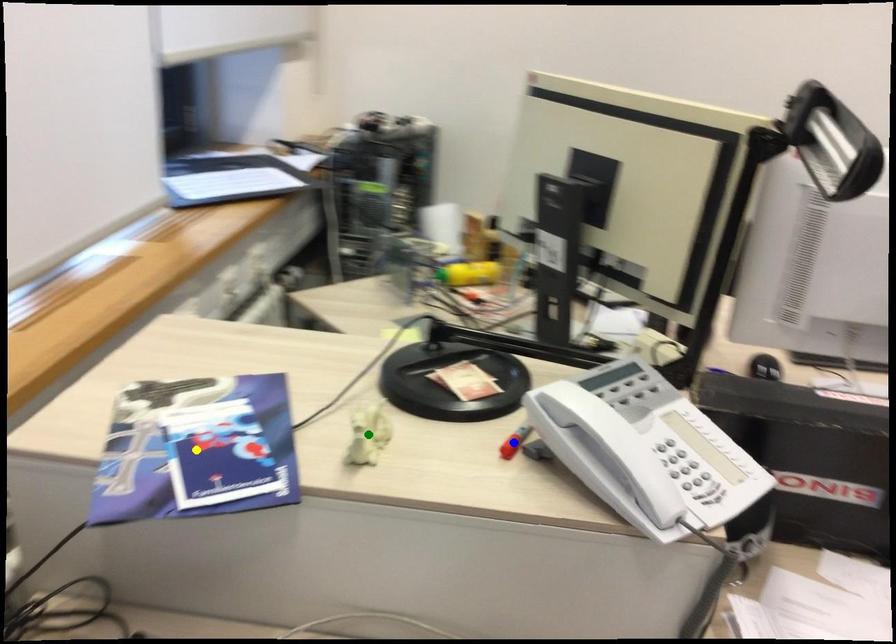
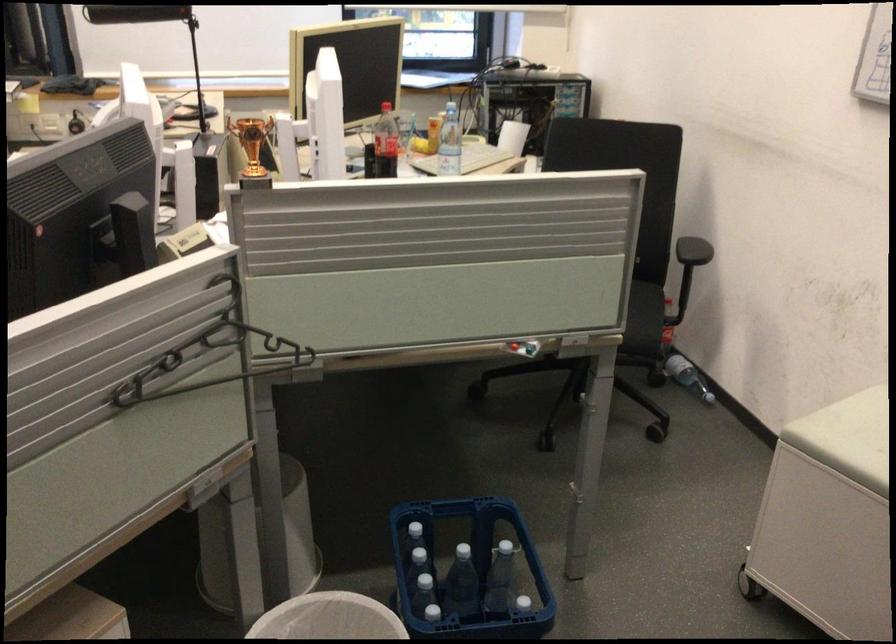
I am providing you with two images of the same scene from different viewpoints. Three points are marked in image1. Which point corresponds to a part or object that is occluded in image2?In image1, three points are marked. Which of them correspond to a part or object that is occluded in image2?Among the three points shown in image1, which one corresponds to a part or object that is no longer visible due to occlusion in image2?

green point, blue point, yellow point